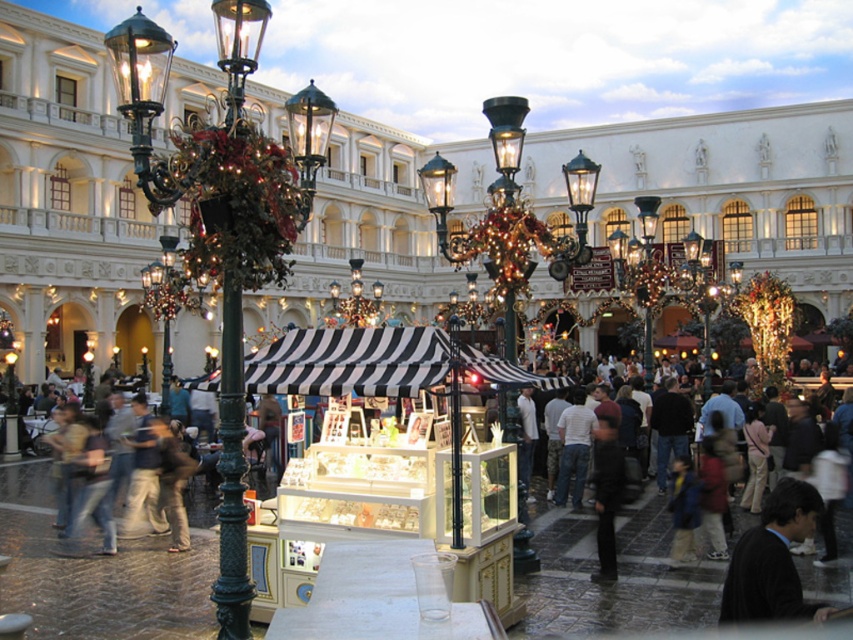
You are standing at the entrance of the market and want to locate the polished brass lamp post at left. According to the coordinate system where the bottom left corner is the origin, can you specify its location?

The polished brass lamp post at left is located at point coordinates of (223, 221).